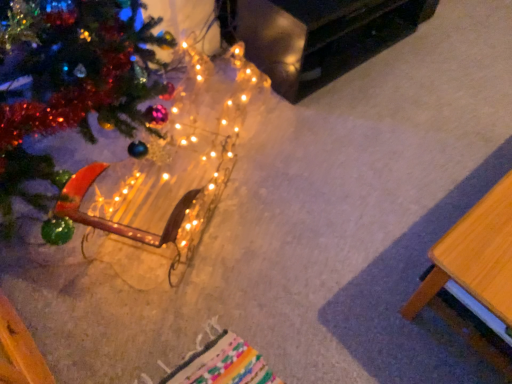
This screenshot has width=512, height=384. I want to click on vacant space in between illuminated wireframe horse at lower left and wooden table at lower right, arranged as the 2th table when viewed from the top, so click(x=329, y=213).